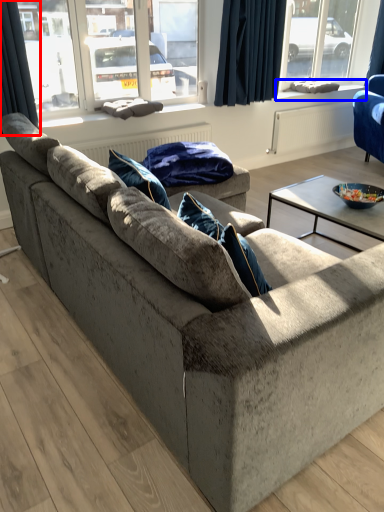
Question: Among these objects, which one is farthest to the camera, curtain (highlighted by a red box) or window sill (highlighted by a blue box)?

Choices:
 (A) curtain
 (B) window sill

Answer: (B)